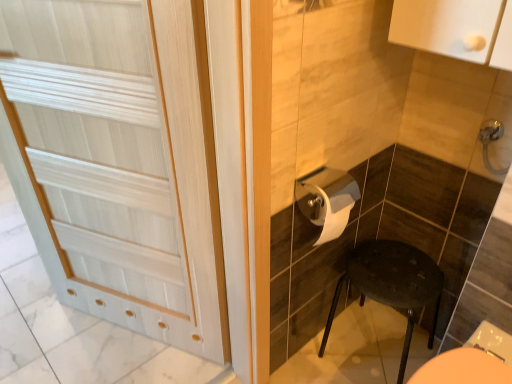
Question: From the image's perspective, is white wood door at left beneath matte black stool at lower right?

Choices:
 (A) no
 (B) yes

Answer: (A)

Question: Is white wood door at left positioned behind matte black stool at lower right?

Choices:
 (A) no
 (B) yes

Answer: (A)

Question: Can you confirm if white wood door at left is thinner than matte black stool at lower right?

Choices:
 (A) no
 (B) yes

Answer: (B)

Question: Does white wood door at left come in front of matte black stool at lower right?

Choices:
 (A) no
 (B) yes

Answer: (B)

Question: Can we say white wood door at left lies outside matte black stool at lower right?

Choices:
 (A) yes
 (B) no

Answer: (A)

Question: Can you confirm if white wood door at left is positioned to the right of matte black stool at lower right?

Choices:
 (A) no
 (B) yes

Answer: (A)

Question: Considering the relative sizes of satin nickel faucet at upper right and white glossy toilet paper at center in the image provided, is satin nickel faucet at upper right wider than white glossy toilet paper at center?

Choices:
 (A) yes
 (B) no

Answer: (B)

Question: Is white glossy toilet paper at center located within satin nickel faucet at upper right?

Choices:
 (A) yes
 (B) no

Answer: (B)

Question: Could you tell me if satin nickel faucet at upper right is facing white glossy toilet paper at center?

Choices:
 (A) no
 (B) yes

Answer: (A)

Question: Are satin nickel faucet at upper right and white glossy toilet paper at center making contact?

Choices:
 (A) yes
 (B) no

Answer: (B)

Question: Does satin nickel faucet at upper right have a larger size compared to white glossy toilet paper at center?

Choices:
 (A) no
 (B) yes

Answer: (A)

Question: Is satin nickel faucet at upper right positioned with its back to white glossy toilet paper at center?

Choices:
 (A) yes
 (B) no

Answer: (B)

Question: Is white glossy toilet paper at center thinner than satin nickel faucet at upper right?

Choices:
 (A) yes
 (B) no

Answer: (B)